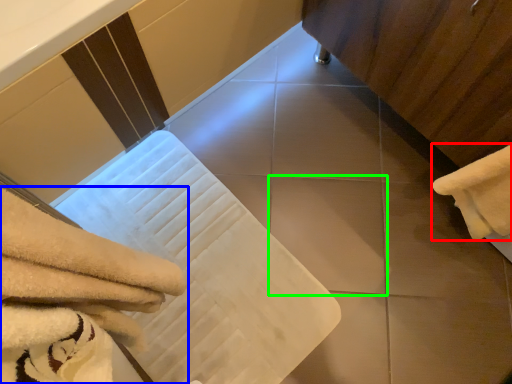
Question: Which object is positioned farthest from towel (highlighted by a red box)? Select from towel (highlighted by a blue box) and tile (highlighted by a green box).

Choices:
 (A) towel
 (B) tile

Answer: (A)